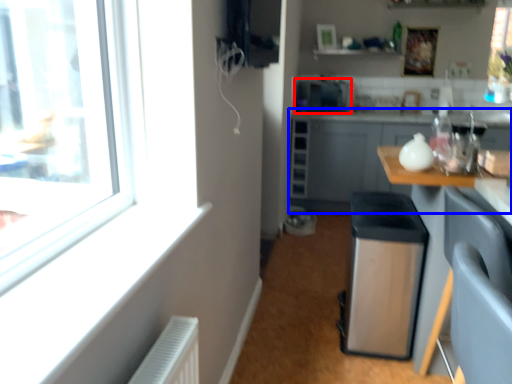
Question: Which object appears farthest to the camera in this image, appliance (highlighted by a red box) or cabinetry (highlighted by a blue box)?

Choices:
 (A) appliance
 (B) cabinetry

Answer: (A)